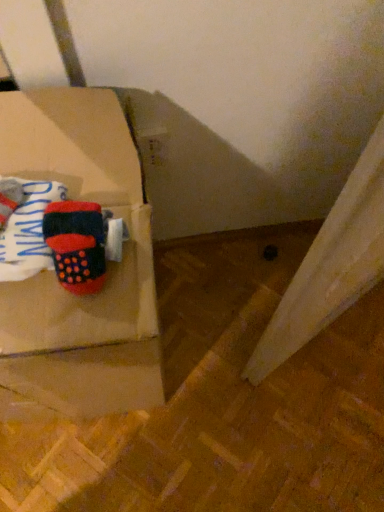
Identify the location of free space in front of matte cardboard box at left. The image size is (384, 512). pyautogui.click(x=95, y=473).